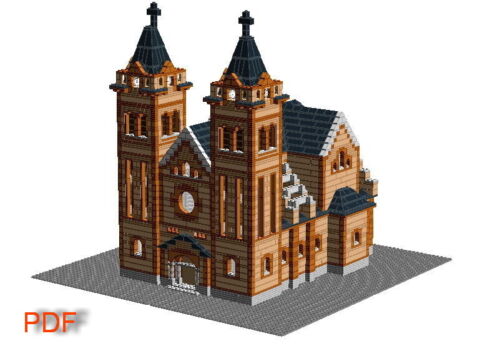
Find the location of a particular element. entryway is located at coordinates (186, 274).